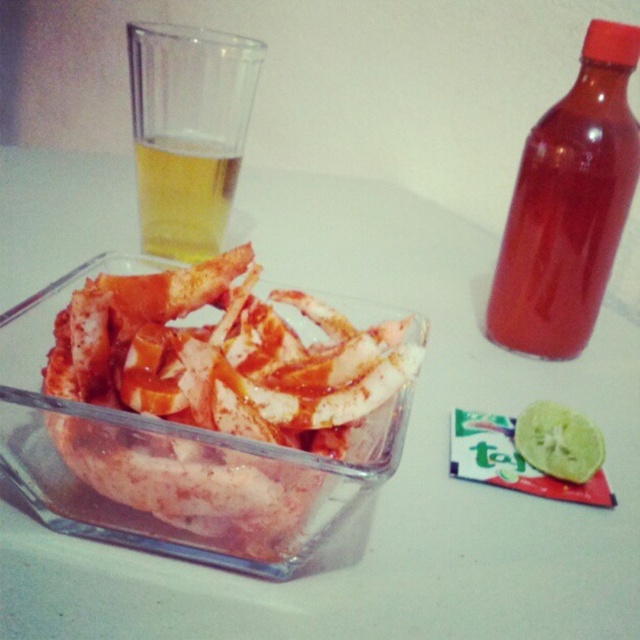
Question: Which point is closer to the camera?

Choices:
 (A) 182,248
 (B) 211,384

Answer: (B)

Question: Can you confirm if slightly crispy white chicken at center is positioned to the left of translucent glass at upper left?

Choices:
 (A) yes
 (B) no

Answer: (B)

Question: Which of the following is the farthest from the observer?

Choices:
 (A) translucent plastic cup at upper left
 (B) translucent glass at upper left

Answer: (B)

Question: Which point is farther from the camera taking this photo?

Choices:
 (A) (193, 170)
 (B) (202, 227)
 (C) (422, 349)

Answer: (B)

Question: Is the position of slightly crispy white chicken at center less distant than that of translucent plastic cup at upper left?

Choices:
 (A) yes
 (B) no

Answer: (A)

Question: Observing the image, what is the correct spatial positioning of translucent plastic cup at upper left in reference to translucent glass at upper left?

Choices:
 (A) right
 (B) left

Answer: (A)